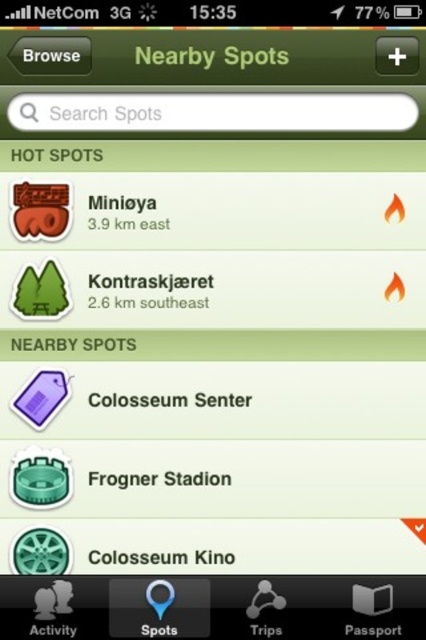
Question: Which object is farther from the camera taking this photo?

Choices:
 (A) green matte sign at center
 (B) white paper colosseum senter at center

Answer: (A)

Question: Is white paper colosseum senter at center smaller than green matte text at center?

Choices:
 (A) yes
 (B) no

Answer: (A)

Question: Can you confirm if white paper colosseum senter at center is thinner than green matte text at center?

Choices:
 (A) no
 (B) yes

Answer: (A)

Question: Can you confirm if black metallic text at center is thinner than green matte text at center?

Choices:
 (A) yes
 (B) no

Answer: (B)

Question: Based on their relative distances, which object is nearer to the black metallic text at center?

Choices:
 (A) green matte sign at center
 (B) white paper colosseum senter at center
 (C) black matte colosseum kino at center
 (D) green matte text at center

Answer: (C)

Question: Which point is closer to the camera taking this photo?

Choices:
 (A) (124, 477)
 (B) (129, 557)
 (C) (158, 397)

Answer: (B)